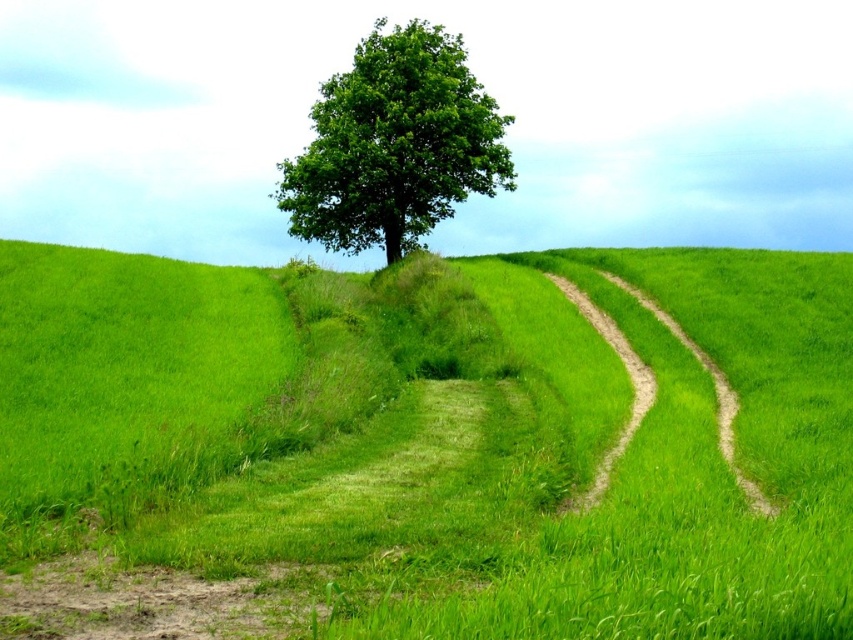
Question: Among these objects, which one is farthest from the camera?

Choices:
 (A) green grassy at center
 (B) green leafy tree at center

Answer: (B)

Question: Considering the relative positions of green grassy at center and green leafy tree at center in the image provided, where is green grassy at center located with respect to green leafy tree at center?

Choices:
 (A) right
 (B) left

Answer: (A)

Question: Does green grassy at center come in front of green leafy tree at center?

Choices:
 (A) yes
 (B) no

Answer: (A)

Question: Does green grassy at center come behind green leafy tree at center?

Choices:
 (A) no
 (B) yes

Answer: (A)